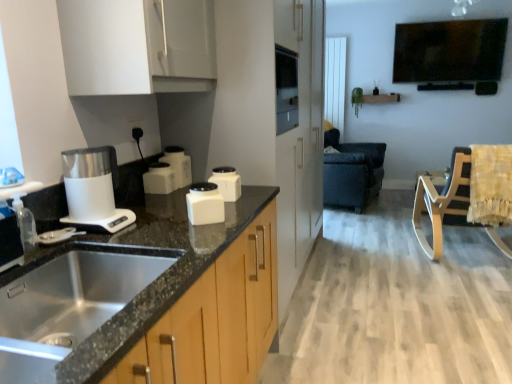
Question: Considering their positions, is white glossy container at center, marked as the 2th kitchen appliance in a back-to-front arrangement, located in front of or behind wooden rocking chair at right, which ranks as the first rocking chair in front-to-back order?

Choices:
 (A) behind
 (B) front

Answer: (B)

Question: In terms of size, does white glossy container at center, the third kitchen appliance in the front-to-back sequence, appear bigger or smaller than wooden rocking chair at right, the 2th rocking chair when ordered from back to front?

Choices:
 (A) small
 (B) big

Answer: (A)

Question: Estimate the real-world distances between objects in this image. Which object is farther from the stainless steel sink at lower left?

Choices:
 (A) black glossy tv at upper right
 (B) white matte cabinet at upper left
 (C) dark leather rocking chair at center, the second rocking chair positioned from the front
 (D) white glossy container at center, positioned as the 4th kitchen appliance in front-to-back order
 (E) white glossy container at center, the fourth kitchen appliance viewed from the back

Answer: (A)

Question: Which is farther from the white glossy container at center, positioned as the 4th kitchen appliance in front-to-back order?

Choices:
 (A) white matte cabinet at upper left
 (B) yellow fabric swivel chair at right
 (C) black glossy tv at upper right
 (D) wooden rocking chair at right, which ranks as the first rocking chair in front-to-back order
 (E) white matte container at center, the 3th kitchen appliance from the back

Answer: (C)